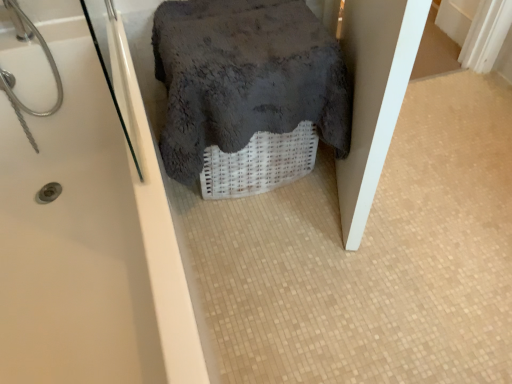
The width and height of the screenshot is (512, 384). What do you see at coordinates (88, 236) in the screenshot?
I see `white glossy bathtub at upper left` at bounding box center [88, 236].

At what (x,y) coordinates should I click in order to perform the action: click on white glossy bathtub at upper left. Please return your answer as a coordinate pair (x, y). Looking at the image, I should click on (88, 236).

What is the approximate height of dark gray fluffy towel at center?

The height of dark gray fluffy towel at center is 15.51 inches.

Describe the element at coordinates (245, 77) in the screenshot. I see `dark gray fluffy towel at center` at that location.

Where is `dark gray fluffy towel at center`? The height and width of the screenshot is (384, 512). dark gray fluffy towel at center is located at coordinates (245, 77).

Measure the distance between dark gray fluffy towel at center and camera.

dark gray fluffy towel at center is 3.79 feet from camera.

Locate an element on the screen. This screenshot has height=384, width=512. white glossy bathtub at upper left is located at coordinates pos(88,236).

Can you confirm if dark gray fluffy towel at center is positioned to the right of white glossy bathtub at upper left?

Yes, dark gray fluffy towel at center is to the right of white glossy bathtub at upper left.

Which object is closer to the camera taking this photo, dark gray fluffy towel at center or white glossy bathtub at upper left?

white glossy bathtub at upper left is closer to the camera.

Considering the points (252, 99) and (161, 336), which point is in front, point (252, 99) or point (161, 336)?

The point (161, 336) is closer.

From the picture: From the image's perspective, which is above, dark gray fluffy towel at center or white glossy bathtub at upper left?

dark gray fluffy towel at center.

From a real-world perspective, relative to white glossy bathtub at upper left, is dark gray fluffy towel at center vertically above or below?

Clearly, from a real-world perspective, dark gray fluffy towel at center is above white glossy bathtub at upper left.

Based on the photo, looking at their sizes, would you say dark gray fluffy towel at center is wider or thinner than white glossy bathtub at upper left?

In the image, dark gray fluffy towel at center appears to be more narrow than white glossy bathtub at upper left.

Who is shorter, dark gray fluffy towel at center or white glossy bathtub at upper left?

Standing shorter between the two is dark gray fluffy towel at center.

Who is bigger, dark gray fluffy towel at center or white glossy bathtub at upper left?

white glossy bathtub at upper left.

Is dark gray fluffy towel at center inside the boundaries of white glossy bathtub at upper left, or outside?

dark gray fluffy towel at center is spatially situated outside white glossy bathtub at upper left.

Can you see dark gray fluffy towel at center touching white glossy bathtub at upper left?

dark gray fluffy towel at center is not next to white glossy bathtub at upper left, and they're not touching.

Is dark gray fluffy towel at center looking in the opposite direction of white glossy bathtub at upper left?

No, white glossy bathtub at upper left is not at the back of dark gray fluffy towel at center.

What's the angular difference between dark gray fluffy towel at center and white glossy bathtub at upper left's facing directions?

There is a 90.1-degree angle between the facing directions of dark gray fluffy towel at center and white glossy bathtub at upper left.

How distant is dark gray fluffy towel at center from white glossy bathtub at upper left?

The distance of dark gray fluffy towel at center from white glossy bathtub at upper left is 15.15 inches.

Find the location of a particular element. bathtub below the dark gray fluffy towel at center (from the image's perspective) is located at coordinates (88, 236).

Which is more to the right, white glossy bathtub at upper left or dark gray fluffy towel at center?

dark gray fluffy towel at center is more to the right.

Which object is closer to the camera taking this photo, white glossy bathtub at upper left or dark gray fluffy towel at center?

white glossy bathtub at upper left is more forward.

Which is farther from the camera, (x=128, y=154) or (x=190, y=41)?

The point (x=190, y=41) is farther.

From the image's perspective, which one is positioned higher, white glossy bathtub at upper left or dark gray fluffy towel at center?

dark gray fluffy towel at center is shown above in the image.

From a real-world perspective, which object rests below the other?

In real-world perspective, white glossy bathtub at upper left is lower.

Between white glossy bathtub at upper left and dark gray fluffy towel at center, which one has smaller width?

Thinner between the two is dark gray fluffy towel at center.

From their relative heights in the image, would you say white glossy bathtub at upper left is taller or shorter than dark gray fluffy towel at center?

Considering their sizes, white glossy bathtub at upper left has more height than dark gray fluffy towel at center.

In the scene shown: Considering the relative sizes of white glossy bathtub at upper left and dark gray fluffy towel at center in the image provided, is white glossy bathtub at upper left smaller than dark gray fluffy towel at center?

Incorrect, white glossy bathtub at upper left is not smaller in size than dark gray fluffy towel at center.

Could dark gray fluffy towel at center be considered to be inside white glossy bathtub at upper left?

That's incorrect, dark gray fluffy towel at center is not inside white glossy bathtub at upper left.

Are white glossy bathtub at upper left and dark gray fluffy towel at center beside each other?

white glossy bathtub at upper left is not next to dark gray fluffy towel at center, and they're not touching.

In the scene shown: Does white glossy bathtub at upper left turn towards dark gray fluffy towel at center?

Yes, white glossy bathtub at upper left is facing dark gray fluffy towel at center.

In the scene shown: Can you tell me how much white glossy bathtub at upper left and dark gray fluffy towel at center differ in facing direction?

The angle between the facing direction of white glossy bathtub at upper left and the facing direction of dark gray fluffy towel at center is 90.1 degrees.

At what (x,y) coordinates should I click in order to perform the action: click on bath towel located on the right of white glossy bathtub at upper left. Please return your answer as a coordinate pair (x, y). Looking at the image, I should click on (245, 77).

Image resolution: width=512 pixels, height=384 pixels. Find the location of `bath towel behind the white glossy bathtub at upper left`. bath towel behind the white glossy bathtub at upper left is located at coordinates (245, 77).

Locate an element on the screen. bathtub lying in front of the dark gray fluffy towel at center is located at coordinates (88, 236).